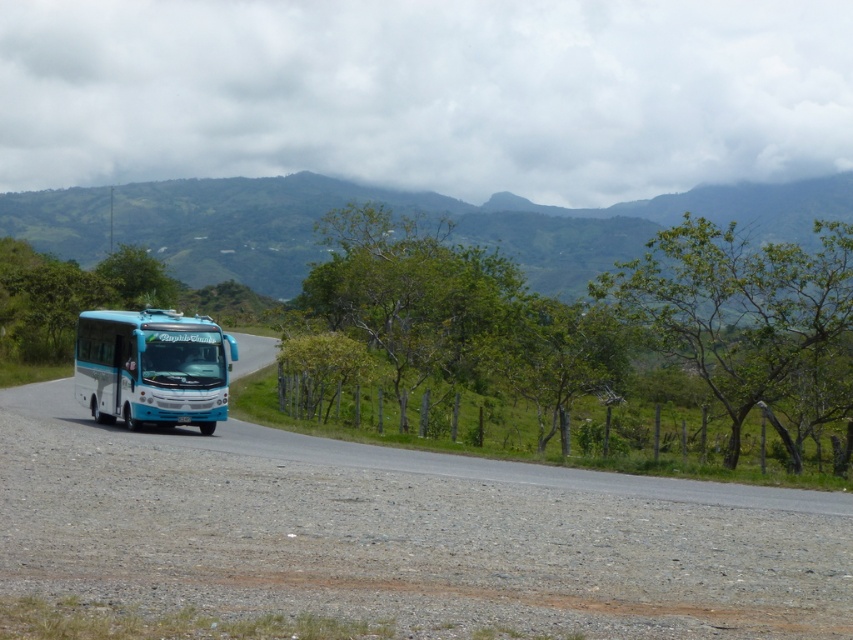
Question: Can you confirm if green leafy mountain at upper center is bigger than teal glossy bus at left?

Choices:
 (A) yes
 (B) no

Answer: (A)

Question: Is green leafy mountain at upper center wider than teal glossy bus at left?

Choices:
 (A) yes
 (B) no

Answer: (A)

Question: Which point is closer to the camera?

Choices:
 (A) teal glossy bus at left
 (B) green leafy mountain at upper center

Answer: (A)

Question: Does green leafy mountain at upper center appear under teal glossy bus at left?

Choices:
 (A) yes
 (B) no

Answer: (B)